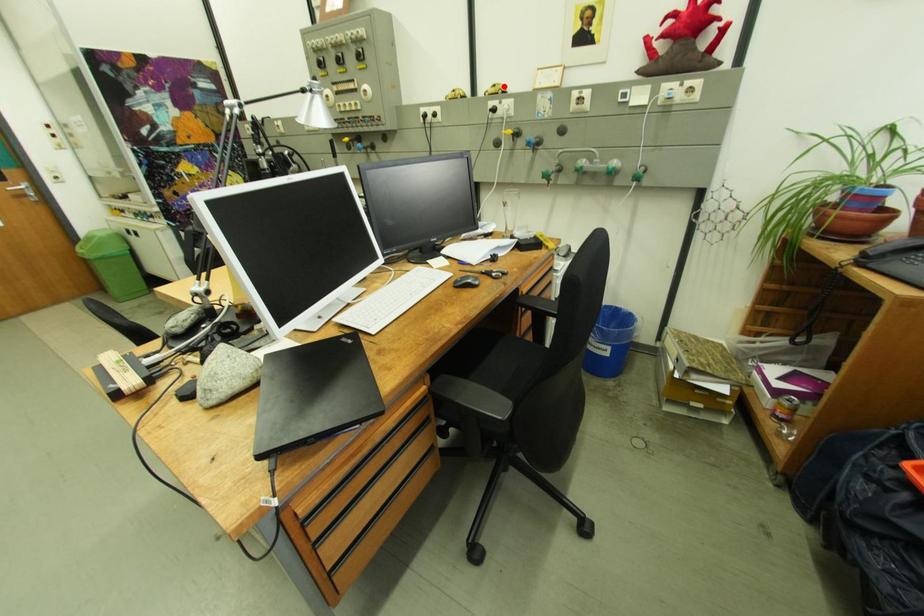
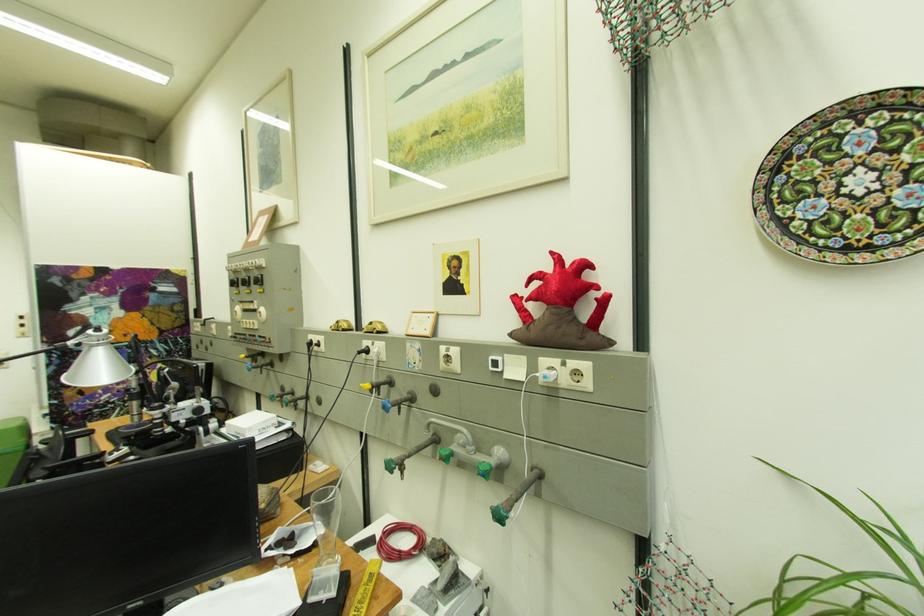
The point at the highlighted location is marked in the first image. Where is the corresponding point in the second image?

(382, 323)